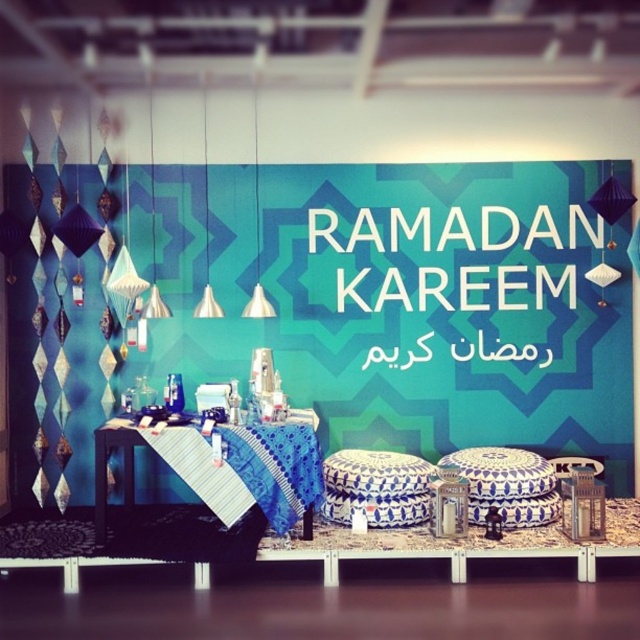
Is point (333, 180) in front of point (310, 419)?

No, (333, 180) is further to viewer.

Where is `blue fabric at center`? blue fabric at center is located at coordinates (404, 305).

Is point (426, 353) behind point (294, 472)?

Yes.

At what (x,y) coordinates should I click in order to perform the action: click on blue fabric at center. Please return your answer as a coordinate pair (x, y). Image resolution: width=640 pixels, height=640 pixels. Looking at the image, I should click on (404, 305).

Is blue fabric table at center thinner than teal fabric at center?

In fact, blue fabric table at center might be wider than teal fabric at center.

Who is more distant from viewer, (93, 436) or (177, 376)?

The point (177, 376) is behind.

Does point (205, 461) lie in front of point (170, 394)?

Yes, it is.

The image size is (640, 640). I want to click on blue fabric table at center, so click(172, 468).

Measure the distance between blue and white ceramic stool at center and camera.

They are 4.94 meters apart.

Does point (353, 513) come behind point (172, 410)?

No, it is in front of (172, 410).

Find the location of a particular element. blue and white ceramic stool at center is located at coordinates (376, 486).